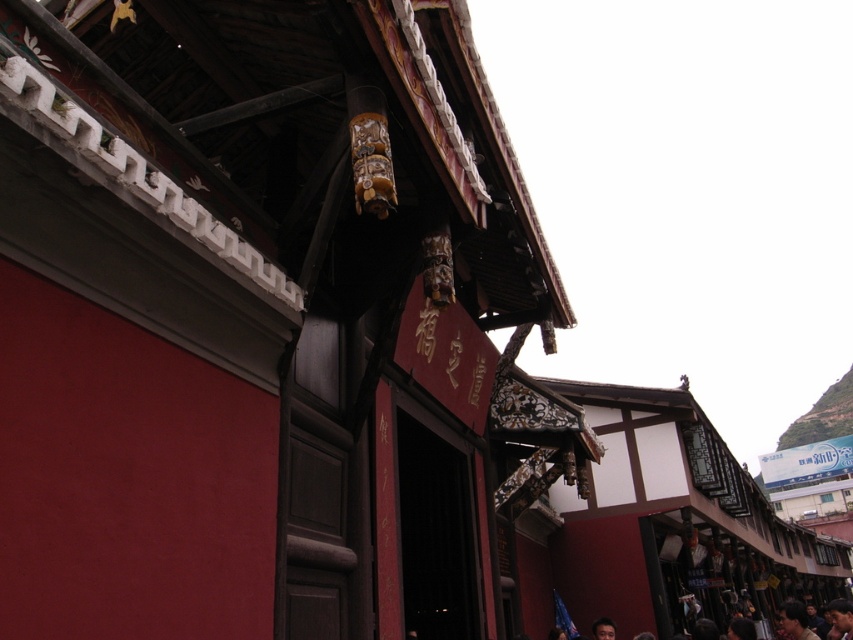
You are a photographer standing in front of the traditional Chinese building with hanging lanterns and red banners. You notice a dark brown leather jacket at lower right and a dark brown hair at lower right. Which object is wider when viewed from your position?

The dark brown leather jacket at lower right is wider than the dark brown hair at lower right according to the description.